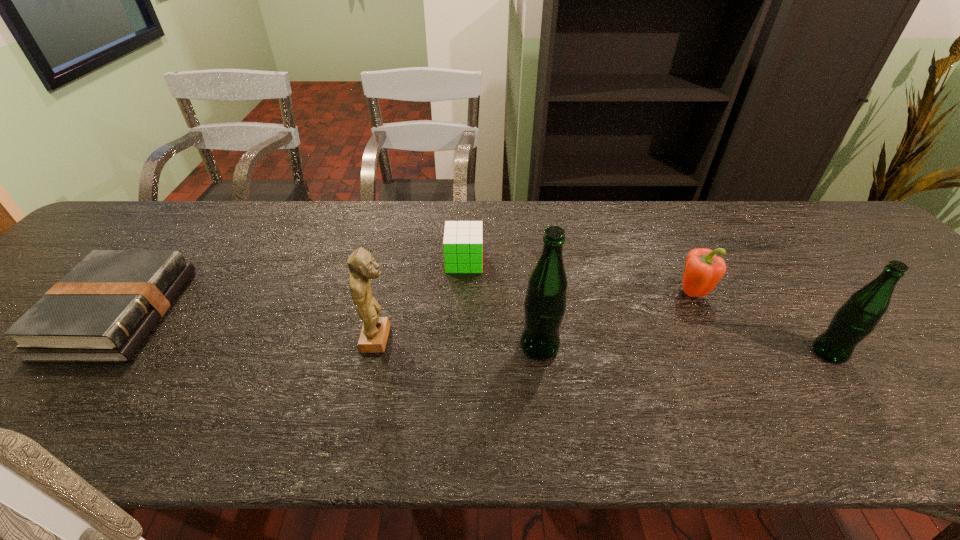
The width and height of the screenshot is (960, 540). I want to click on free space at the far right corner of the desktop, so click(x=842, y=238).

You are a GUI agent. You are given a task and a screenshot of the screen. Output one action in this format:
    pyautogui.click(x=<x>, y=<y>)
    Task: Click on the vacant space in between the rightmost object and the fifth tallest object
    This screenshot has height=540, width=960.
    Given the screenshot: What is the action you would take?
    pyautogui.click(x=647, y=307)

This screenshot has width=960, height=540. In order to click on free space between the tallest object and the cube in this screenshot , I will do `click(502, 303)`.

You are a GUI agent. You are given a task and a screenshot of the screen. Output one action in this format:
    pyautogui.click(x=<x>, y=<y>)
    Task: Click on the free spot between the shorter beer bottle and the pepper
    
    Given the screenshot: What is the action you would take?
    pyautogui.click(x=760, y=322)

Where is `free spot between the hardback book and the fifth object from left to right`? free spot between the hardback book and the fifth object from left to right is located at coordinates (405, 302).

This screenshot has height=540, width=960. I want to click on vacant point located between the fifth tallest object and the rightmost object, so click(647, 307).

Where is `vacant area that lies between the figurine and the third object from left to right`? This screenshot has height=540, width=960. vacant area that lies between the figurine and the third object from left to right is located at coordinates (420, 300).

What are the coordinates of `empty location between the shortest object and the left beer bottle` in the screenshot? It's located at (329, 329).

At what (x,y) coordinates should I click in order to perform the action: click on free space between the second shortest object and the fifth object from left to right. Please return your answer as a coordinate pair (x, y). This screenshot has width=960, height=540. Looking at the image, I should click on (578, 277).

Where is `free space between the figurine and the leftmost object`? The width and height of the screenshot is (960, 540). free space between the figurine and the leftmost object is located at coordinates (249, 326).